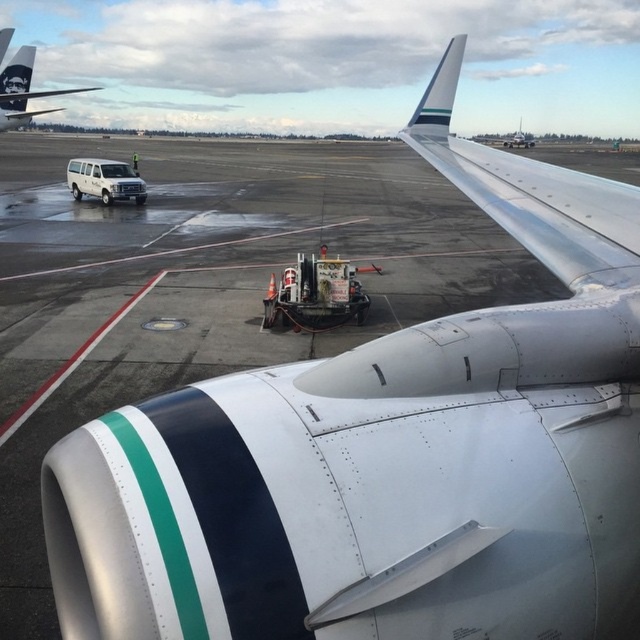
You are a maintenance worker standing at the back of the white matte van at left. You need to inspect the silver metallic wing at upper right. Can you see the entire wing without moving your position?

The silver metallic wing at upper right is taller than the white matte van at left, so you might not be able to see the entire wing from your current position at the back of the van due to its height difference.

You are standing at the camera position and looking at the two points labeled point (x=20, y=99) and point (x=68, y=182). Which point is closer to you?

Point (x=20, y=99) is further to the camera than point (x=68, y=182), so the closer point to you is point (x=68, y=182).

You are a ground crew member who needs to park a new vehicle next to the matte black airplane at upper left and the white matte van at left. Based on their sizes, which vehicle should you place farther away to ensure there is enough space?

Since the matte black airplane at upper left is wider than the white matte van at left, you should place the matte black airplane at upper left farther away to accommodate its larger size.